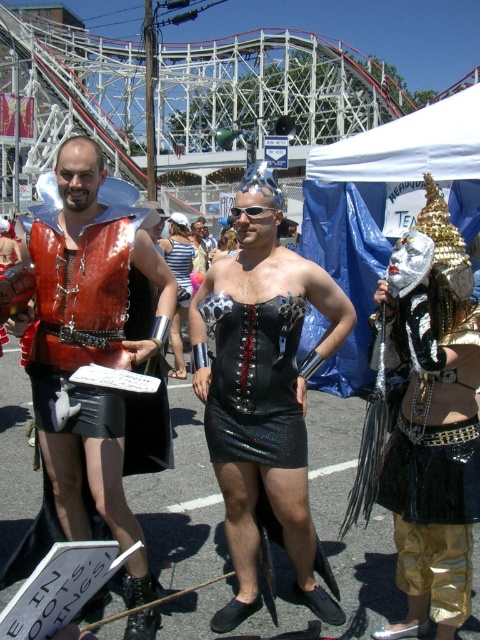
Question: Among these points, which one is nearest to the camera?

Choices:
 (A) (98, 486)
 (B) (228, 250)
 (C) (168, 232)

Answer: (A)

Question: Which point is closer to the camera?

Choices:
 (A) (181, 285)
 (B) (97, 481)
 (C) (239, 244)
 (D) (239, 406)

Answer: (B)

Question: Does shiny black dress at center lie behind metallic silver dress at center?

Choices:
 (A) yes
 (B) no

Answer: (B)

Question: Among these objects, which one is farthest from the camera?

Choices:
 (A) black leather dress at center
 (B) shiny black dress at center

Answer: (A)

Question: Considering the relative positions of metallic silver dress at center and black leather dress at center in the image provided, where is metallic silver dress at center located with respect to black leather dress at center?

Choices:
 (A) left
 (B) right

Answer: (A)

Question: Does shiny black dress at center have a smaller size compared to metallic silver dress at center?

Choices:
 (A) no
 (B) yes

Answer: (B)